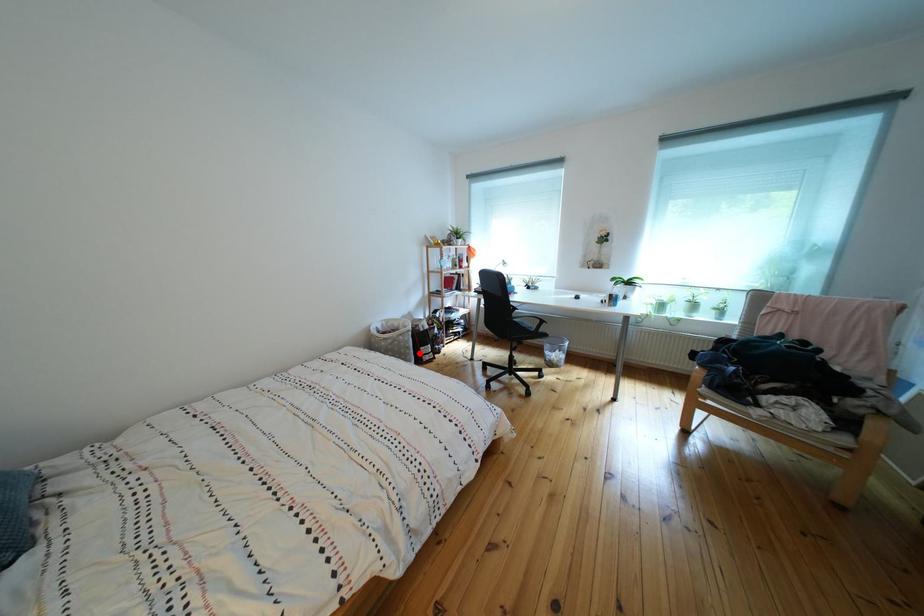
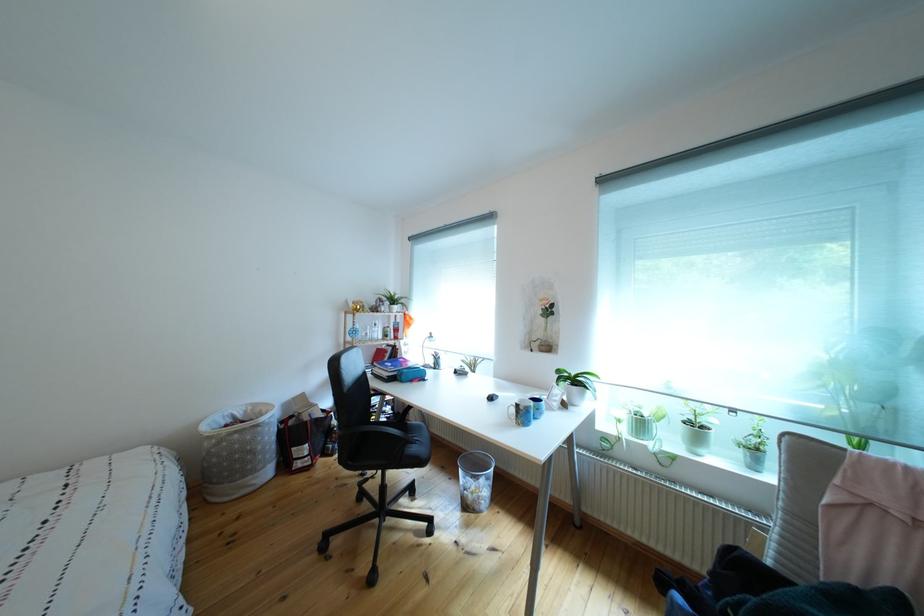
The point at the highlighted location is marked in the first image. Where is the corresponding point in the second image?

(263, 456)